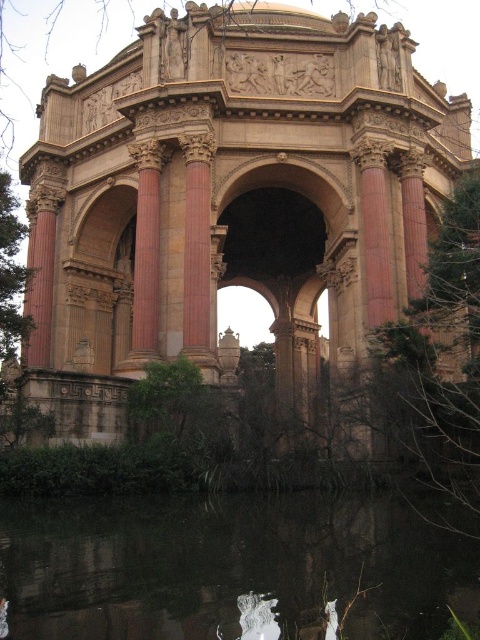
Question: Observing the image, what is the correct spatial positioning of smooth pink stone column at center in reference to reddish-brown stone column at center-left?

Choices:
 (A) above
 (B) below

Answer: (A)

Question: Based on their relative distances, which object is nearer to the reddish-brown stone column at center-left?

Choices:
 (A) beige stone palace at center
 (B) smooth pink stone column at center

Answer: (B)

Question: Which object is the farthest from the smooth pink stone column at center?

Choices:
 (A) beige stone palace at center
 (B) reddish-brown stone column at center-left

Answer: (A)

Question: Which point is closer to the camera?

Choices:
 (A) (50, 358)
 (B) (410, 531)
 (C) (201, 348)

Answer: (B)

Question: Is smooth pink stone column at center wider than reddish-brown stone column at center-left?

Choices:
 (A) no
 (B) yes

Answer: (A)

Question: Does beige stone palace at center appear on the right side of smooth pink stone column at center?

Choices:
 (A) yes
 (B) no

Answer: (A)